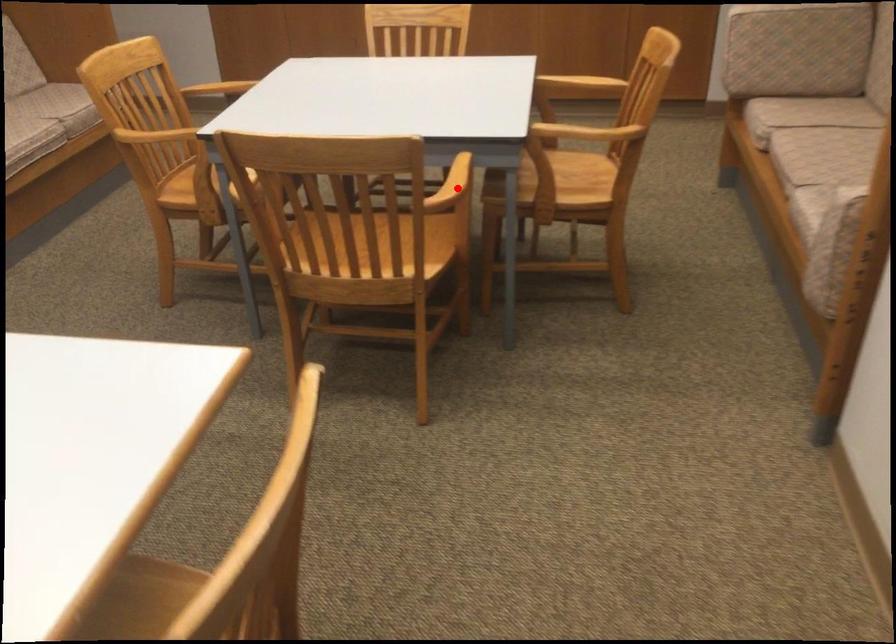
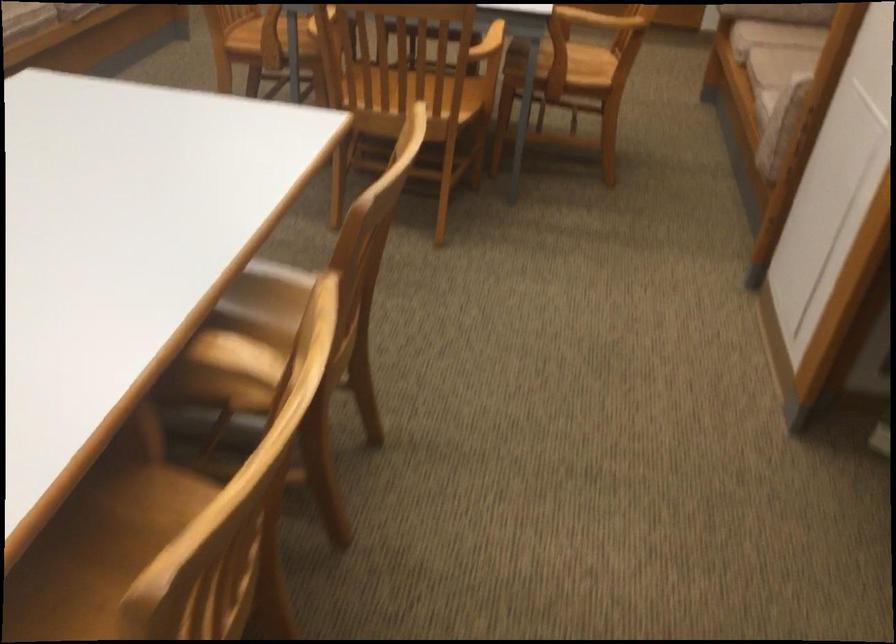
Question: I am providing you with two images of the same scene from different viewpoints. Given a red point in image1, look at the same physical point in image2. Is it:

Choices:
 (A) Closer to the viewpoint
 (B) Farther from the viewpoint

Answer: (B)